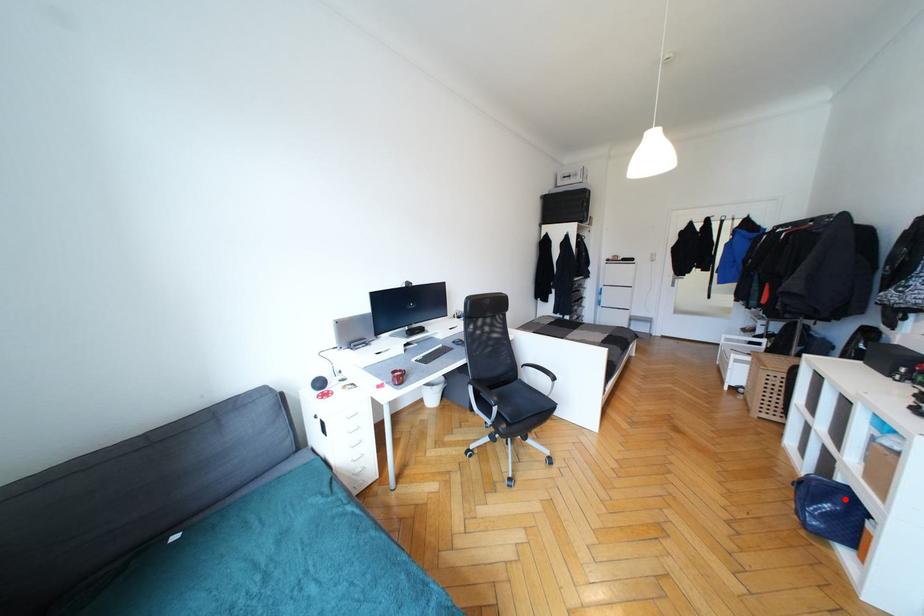
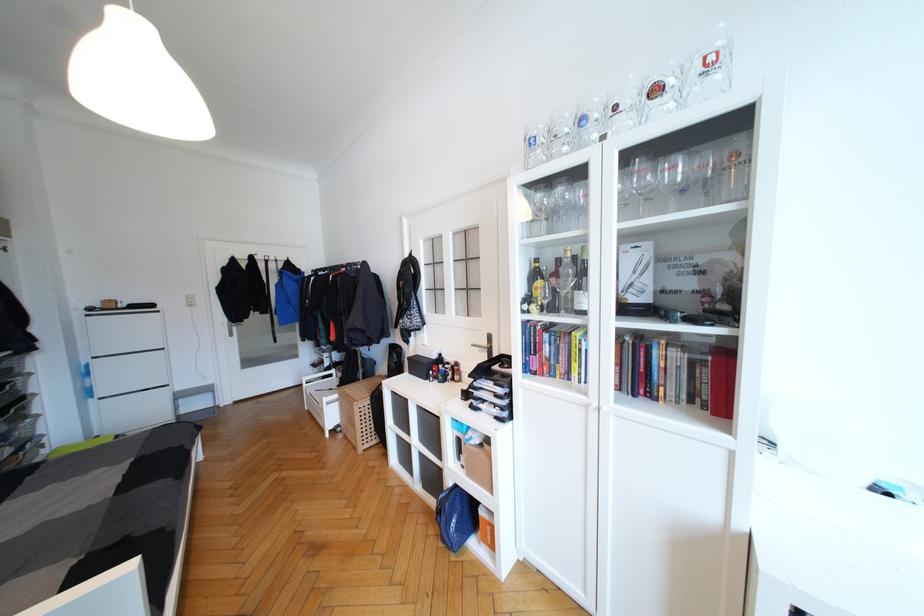
Question: I am providing you with two images of the same scene from different viewpoints. A red point is shown in image1. For the corresponding object point in image2, is it positioned nearer or farther from the camera?

Choices:
 (A) Nearer
 (B) Farther

Answer: (A)